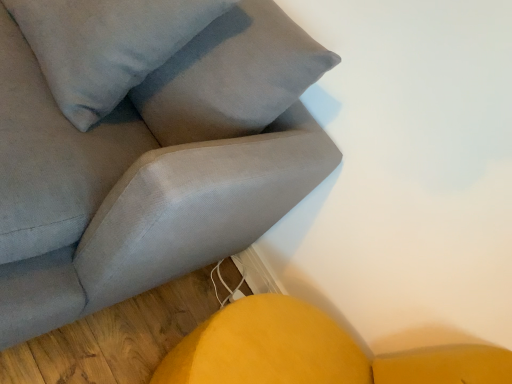
Question: Is suede gray couch at upper left inside or outside of satin gray pillow at upper left?

Choices:
 (A) outside
 (B) inside

Answer: (A)

Question: Is point (138, 109) closer or farther from the camera than point (86, 52)?

Choices:
 (A) closer
 (B) farther

Answer: (B)

Question: From a real-world perspective, is suede gray couch at upper left physically located above or below satin gray pillow at upper left?

Choices:
 (A) above
 (B) below

Answer: (B)

Question: Considering the positions of satin gray pillow at upper left and suede gray couch at upper left in the image, is satin gray pillow at upper left wider or thinner than suede gray couch at upper left?

Choices:
 (A) thin
 (B) wide

Answer: (A)

Question: Is satin gray pillow at upper left situated inside suede gray couch at upper left or outside?

Choices:
 (A) outside
 (B) inside

Answer: (B)

Question: In terms of height, does satin gray pillow at upper left look taller or shorter compared to suede gray couch at upper left?

Choices:
 (A) short
 (B) tall

Answer: (A)

Question: From a real-world perspective, is satin gray pillow at upper left positioned above or below suede gray couch at upper left?

Choices:
 (A) below
 (B) above

Answer: (B)